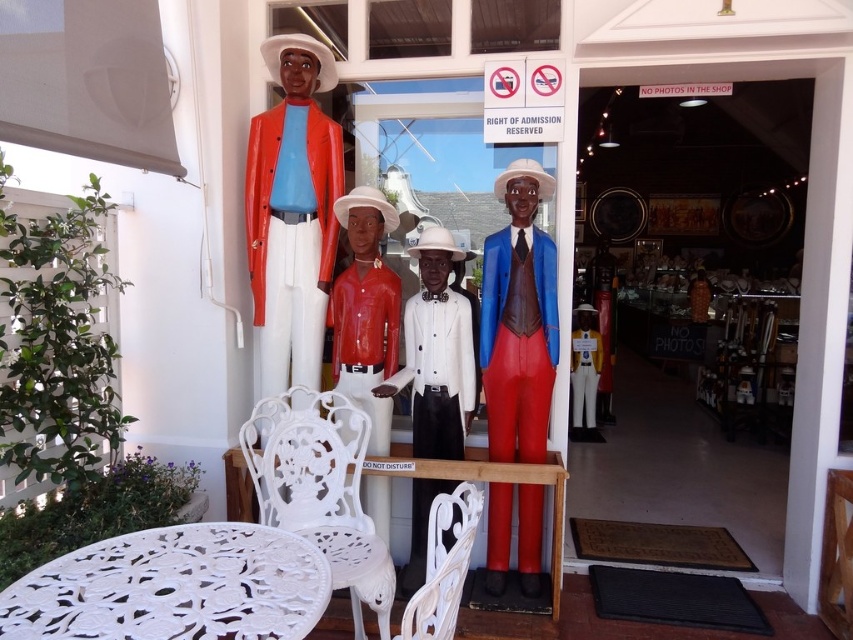
You are a customer looking to buy a chair that can fit under the table. The table has a space that can only accommodate items smaller than the white cast iron chair at lower left. Do you think the matte blue suit at center would fit under the table?

The matte blue suit at center has a smaller size compared to the white cast iron chair at lower left, so it would fit under the table since it is smaller than the required space.

You are standing at the entrance of the shop and want to place a decorative vase on the white carved wood table at lower left. Given that the table is at coordinates 0.917, 0.205, can you confirm its position relative to the mannequins?

The white carved wood table at lower left is located at point (173, 586), which is in front of the mannequins, so placing the vase there would position it in front of them.

You are a customer standing in front of the display. You want to sit on the white cast iron chair at lower left. Can you see the matte red mannequin at center from your seated position?

The white cast iron chair at lower left is in front of the matte red mannequin at center, so when you sit on the white cast iron chair at lower left, you will be facing towards the matte red mannequin at center and can see it clearly.